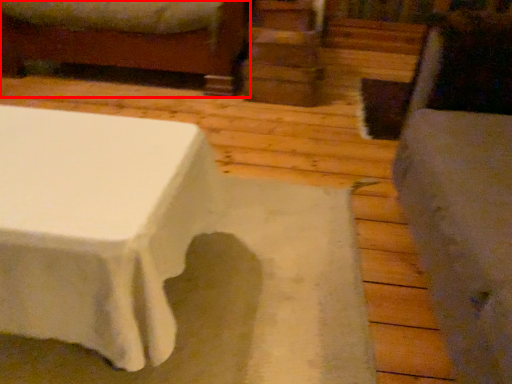
Question: Where is furniture (annotated by the red box) located in relation to swivel chair in the image?

Choices:
 (A) left
 (B) right

Answer: (A)